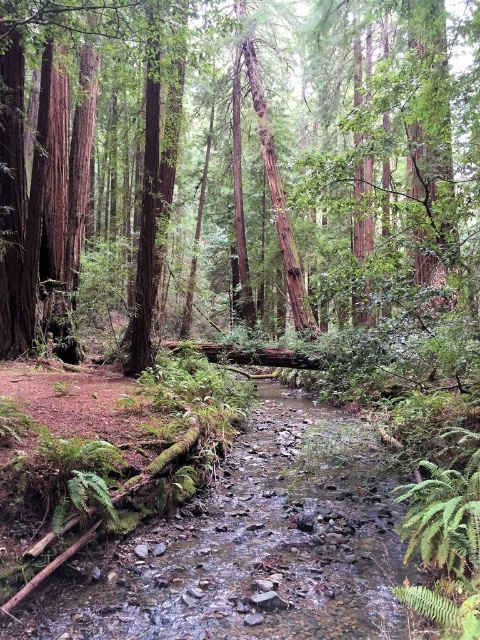
Does smooth brown tree trunk at center appear over smooth rock stream at center?

Yes, smooth brown tree trunk at center is above smooth rock stream at center.

Can you confirm if smooth brown tree trunk at center is smaller than smooth rock stream at center?

No.

The image size is (480, 640). In order to click on smooth brown tree trunk at center in this screenshot , I will do `click(348, 156)`.